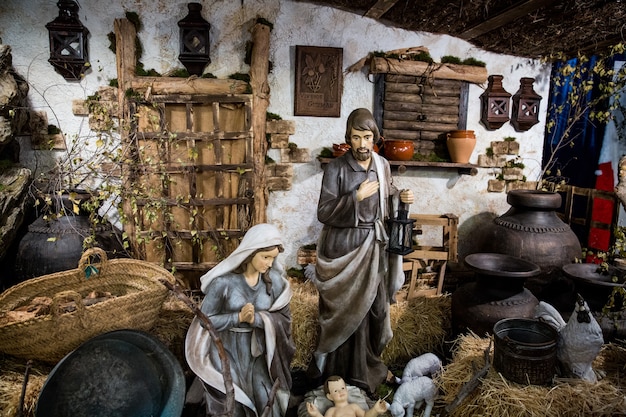
Locate an element on the screen. The image size is (626, 417). horizontal board on wood grid is located at coordinates (187, 102), (190, 136), (190, 165), (193, 198), (197, 229), (195, 265).